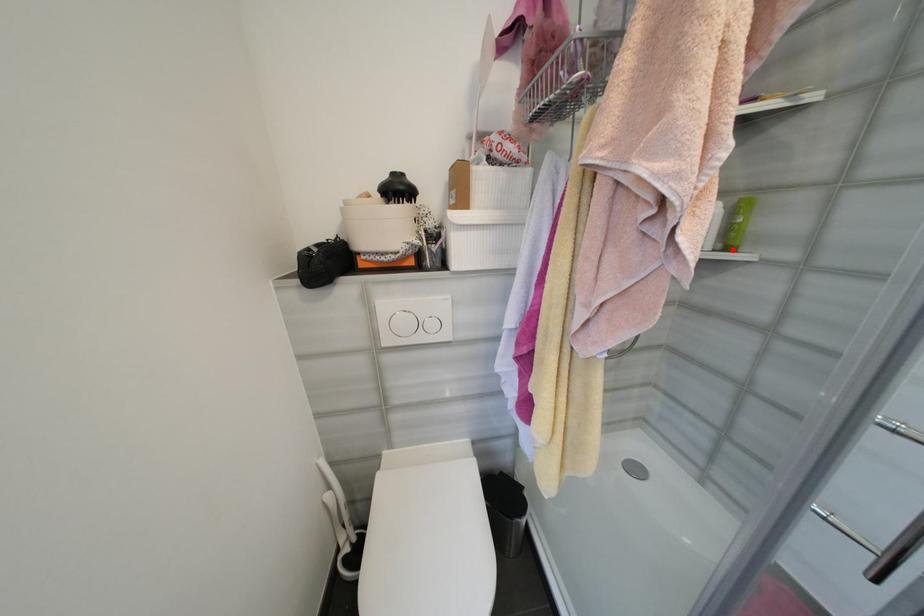
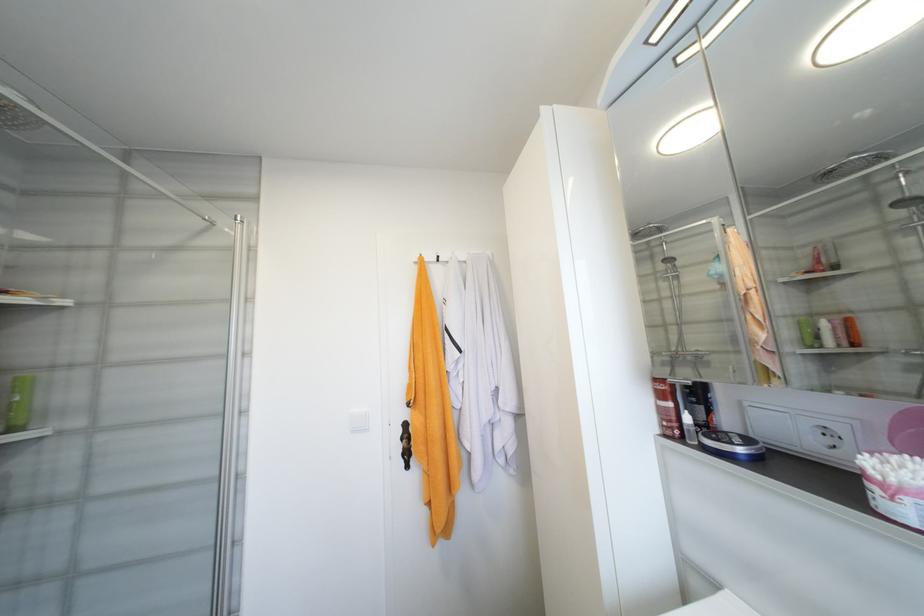
The point at the highlighted location is marked in the first image. Where is the corresponding point in the second image?

(19, 430)